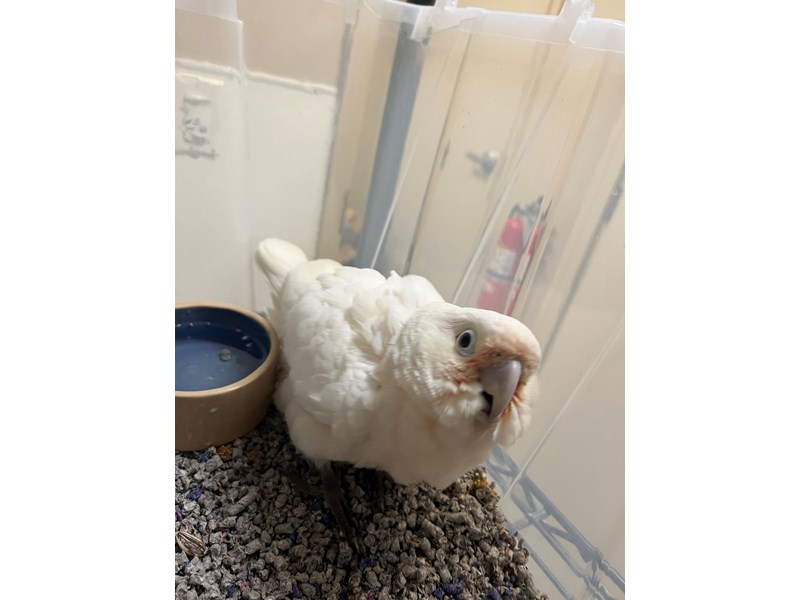
Locate an element on the screen. table is located at coordinates (524, 517).